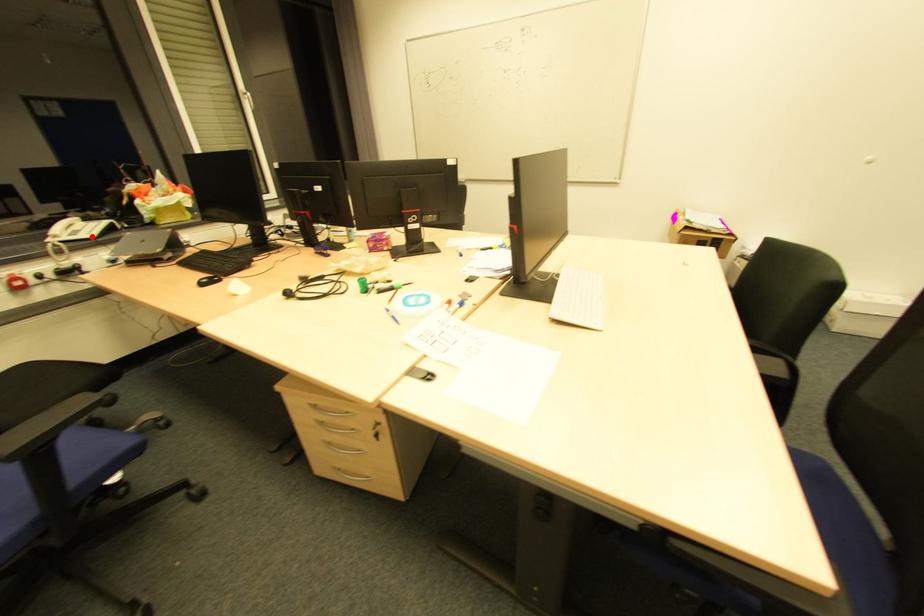
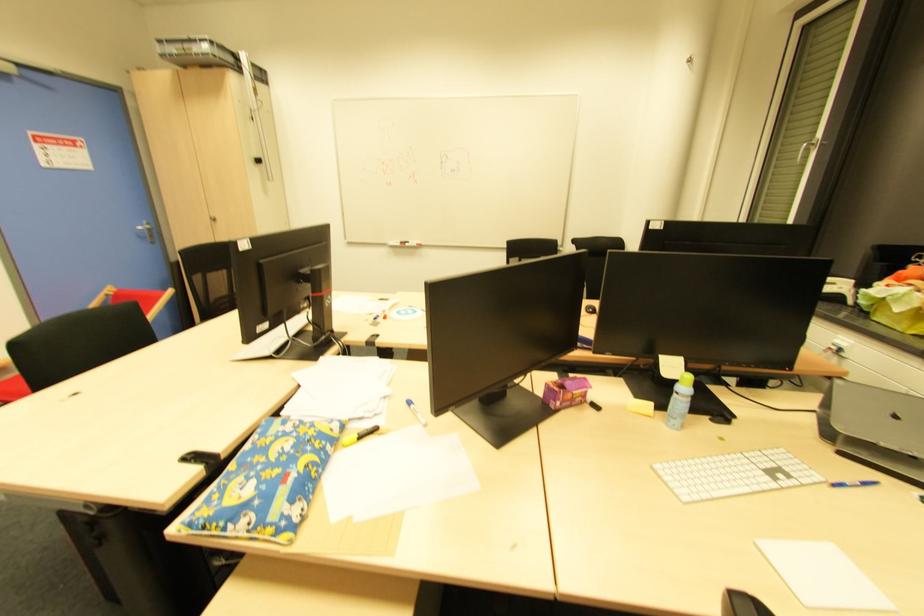
Question: I am providing you with two images of the same scene from different viewpoints. A red point is marked on the first image. Can you still see the location of the red point in image 2?

Choices:
 (A) Yes
 (B) No

Answer: (B)